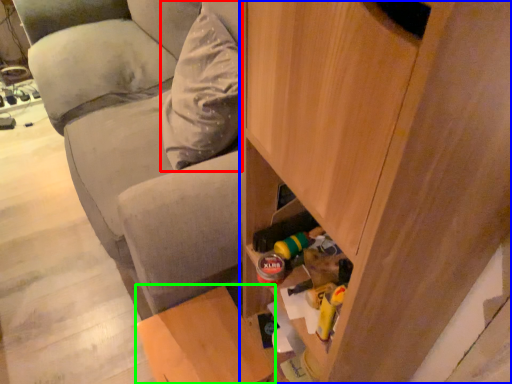
Question: Which is farther away from pillow (highlighted by a red box)? cabinetry (highlighted by a blue box) or furniture (highlighted by a green box)?

Choices:
 (A) cabinetry
 (B) furniture

Answer: (A)